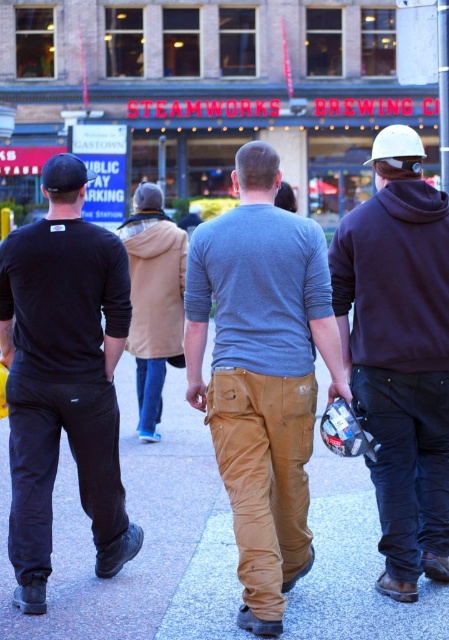
Question: Does hard hat at right appear on the left side of white matte baseball hat at upper right?

Choices:
 (A) yes
 (B) no

Answer: (A)

Question: Does matte gray sweater at center appear on the right side of hard hat at right?

Choices:
 (A) yes
 (B) no

Answer: (B)

Question: Which point is farther to the camera?

Choices:
 (A) (391, 634)
 (B) (44, 182)
 (C) (405, 476)

Answer: (B)

Question: Where is white matte baseball hat at upper right located in relation to black fabric baseball cap at upper left in the image?

Choices:
 (A) above
 (B) below

Answer: (A)

Question: Which object appears farthest from the camera in this image?

Choices:
 (A) matte gray sweater at center
 (B) smooth concrete pavement at center
 (C) white matte baseball hat at upper right
 (D) black matte pants at left

Answer: (B)

Question: Which point appears farthest from the camera in this image?

Choices:
 (A) (83, 179)
 (B) (250, 588)
 (C) (149, 250)

Answer: (C)